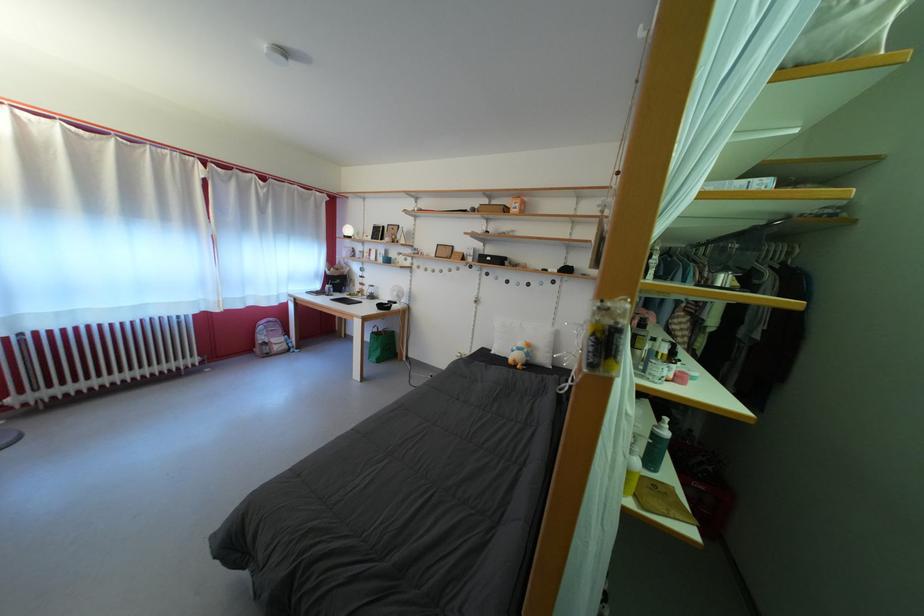
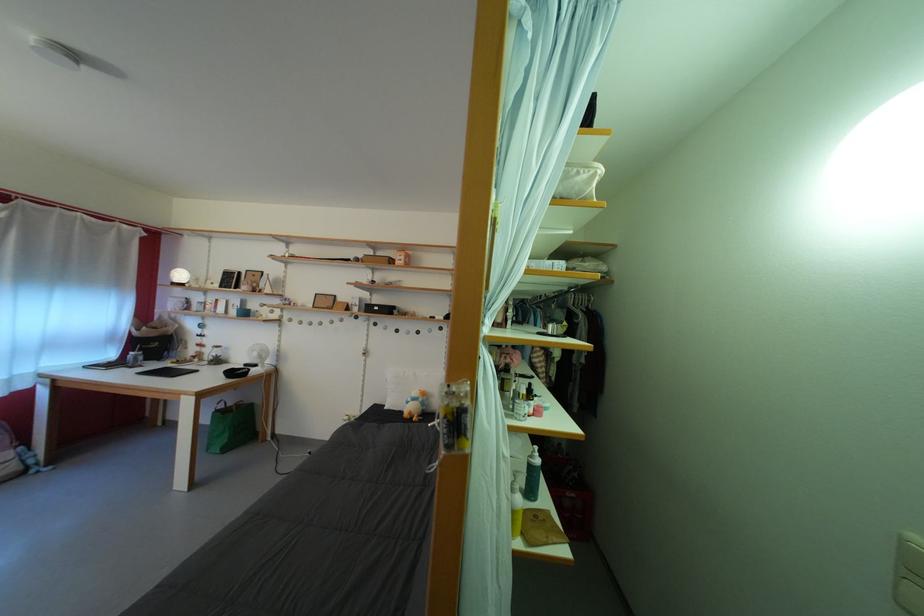
Where in the second image is the point corresponding to (665,432) from the first image?

(540, 463)